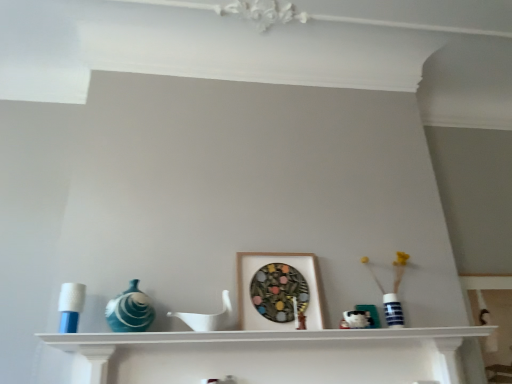
Identify the location of vacant region under blue striped vase at right (from a real-world perspective). (400, 337).